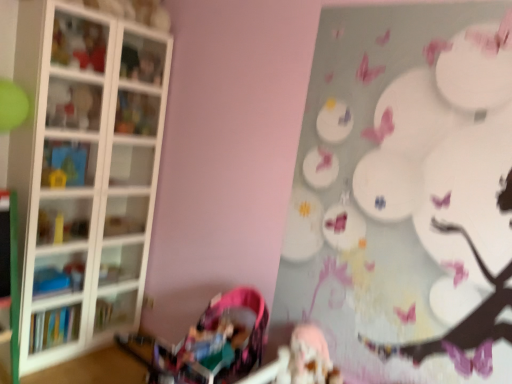
Question: Would you say blue plastic toy at left, the third shelf from the top, is to the left or to the right of matte white cabinet at upper left in the picture?

Choices:
 (A) left
 (B) right

Answer: (A)

Question: In terms of height, does blue plastic toy at left, the third shelf from the top, look taller or shorter compared to matte white cabinet at upper left?

Choices:
 (A) tall
 (B) short

Answer: (A)

Question: Which is nearer to the matte plastic shelf at upper left, the fourth shelf when ordered from bottom to top?

Choices:
 (A) hardcover book at left
 (B) matte white cabinet at upper left
 (C) pink fabric baby carriage at lower left
 (D) translucent glass shelf at upper left, the 1th shelf when ordered from top to bottom
 (E) blue plastic toy at left, the third shelf from the top

Answer: (E)

Question: Which object is positioned closest to the blue plastic toy at left, the third shelf from the top?

Choices:
 (A) pink fabric baby carriage at lower left
 (B) matte plastic shelf at upper left, the fourth shelf when ordered from bottom to top
 (C) matte plastic toy at upper left
 (D) white glass shelves at left, arranged as the fourth shelf when viewed from the top
 (E) translucent glass shelf at upper left, the 1th shelf when ordered from top to bottom

Answer: (B)